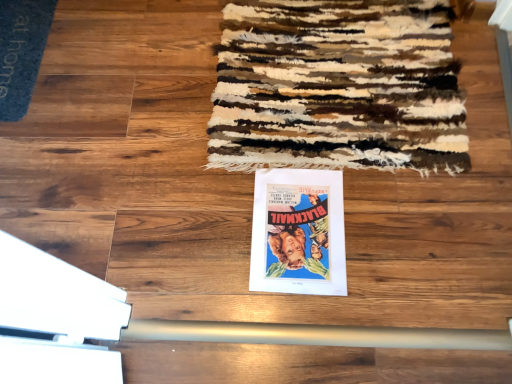
Find the location of a particular element. free space in front of matte paper poster at center is located at coordinates (317, 304).